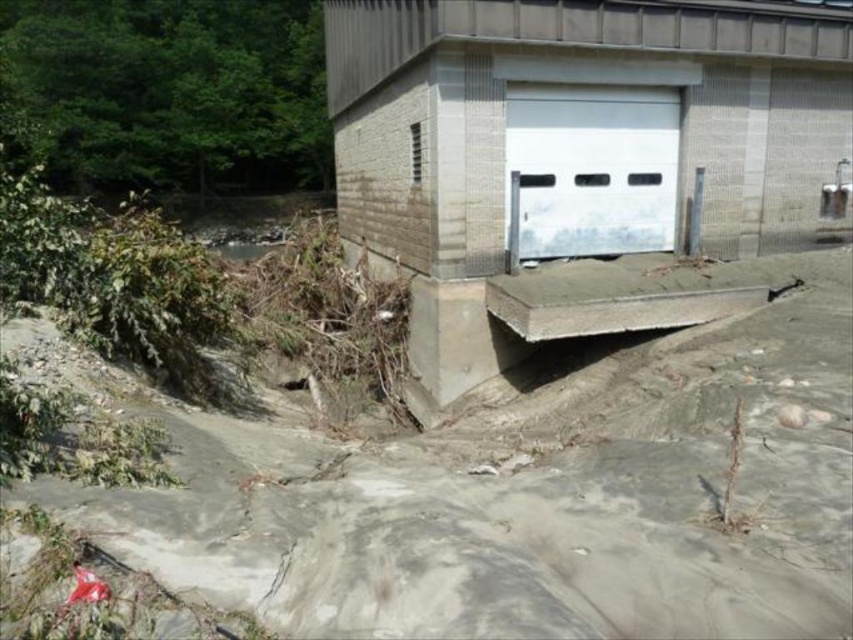
You are a construction worker assessing the damage to the gray concrete at lower center and the white smooth garage door at center. Which object is nearer to you as you stand in front of the structure?

The gray concrete at lower center is closer to the viewer than the white smooth garage door at center, so the gray concrete at lower center is nearer to you.

You are a construction inspector assessing the damage to the gray concrete at lower center and the white matte garage door at center. Based on their positions, which object is closer to the ground?

The gray concrete at lower center is positioned under the white matte garage door at center, so it is closer to the ground.